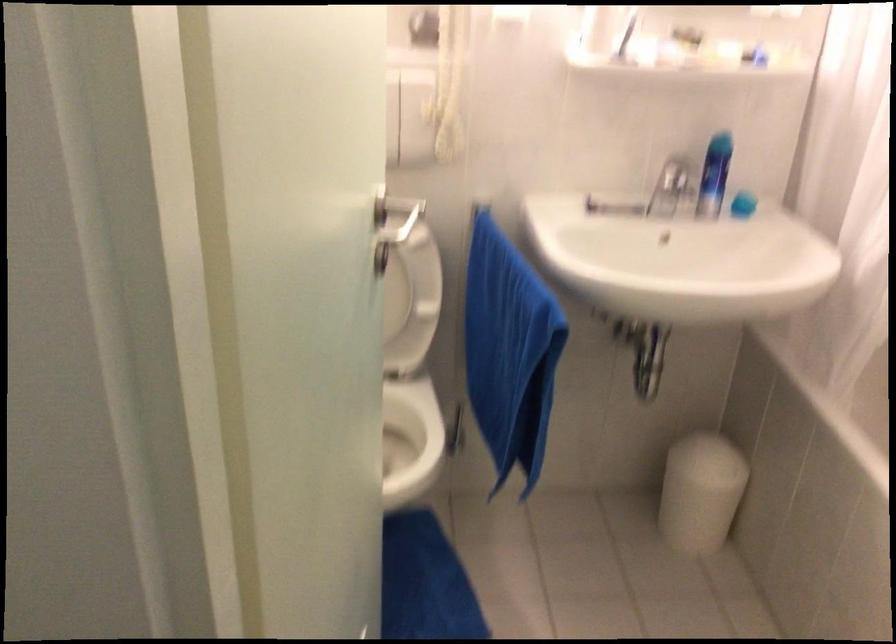
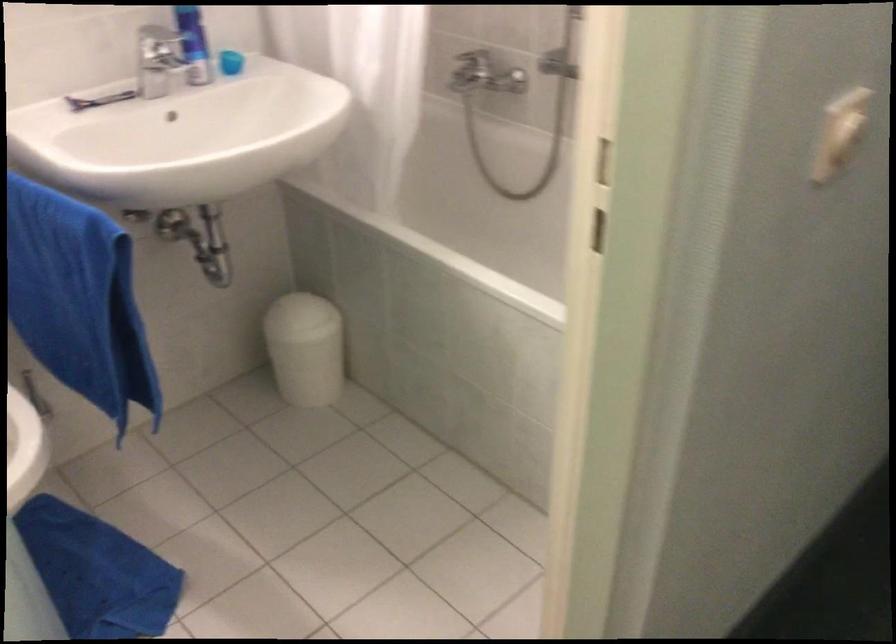
In the second image, find the point that corresponds to point (666, 254) in the first image.

(183, 137)